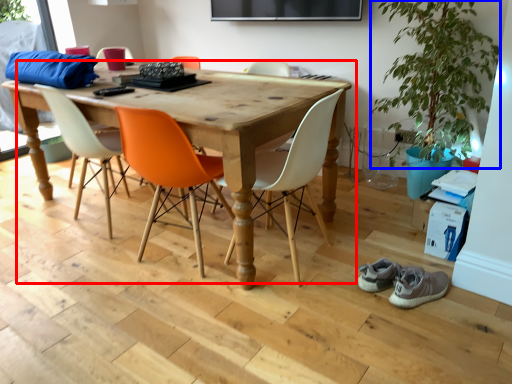
Question: Which object is closer to the camera taking this photo, kitchen & dining room table (highlighted by a red box) or plant (highlighted by a blue box)?

Choices:
 (A) kitchen & dining room table
 (B) plant

Answer: (A)